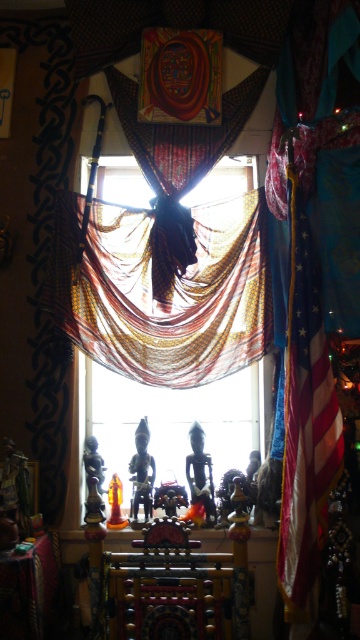
You are standing in the room and see the point marked at coordinates (173,291). Based on the scene description, can you determine what object or surface this point is located on?

The point at coordinates (173,291) is located on the multicolored sheer fabric at center.

You are a guest in this room and want to see the view outside the window. The multicolored sheer fabric at center and the american flag at right are blocking your view. Which object should you move to get a clearer view?

You should move the multicolored sheer fabric at center because it is positioned over the american flag at right, so removing it would allow more visibility through the window.

You are an interior designer planning to replace the multicolored sheer fabric at center and the transparent fabric at center with new ones. If you want to keep the same size as the existing ones, which fabric should you choose for the one that currently covers less area?

The multicolored sheer fabric at center is smaller than the transparent fabric at center, so you should choose a smaller fabric for the multicolored sheer fabric at center and a larger one for the transparent fabric at center to maintain their current sizes.